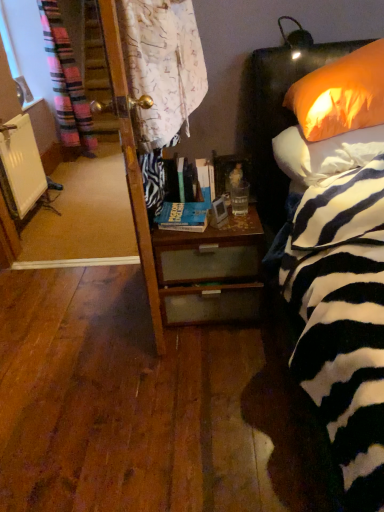
Question: Does hardcover book at center, the 1th book from the front, appear on the right side of orange fabric pillow at upper right, arranged as the 2th pillow when ordered from the bottom?

Choices:
 (A) no
 (B) yes

Answer: (A)

Question: Is orange fabric pillow at upper right, which is the 1th pillow from top to bottom, located within hardcover book at center, the 1th book from the front?

Choices:
 (A) no
 (B) yes

Answer: (A)

Question: Is hardcover book at center, which is counted as the 2th book, starting from the top, touching orange fabric pillow at upper right, arranged as the 2th pillow when ordered from the bottom?

Choices:
 (A) no
 (B) yes

Answer: (A)

Question: Is hardcover book at center, the second book positioned from the back, not within orange fabric pillow at upper right, arranged as the 2th pillow when ordered from the bottom?

Choices:
 (A) no
 (B) yes

Answer: (B)

Question: Considering the relative sizes of hardcover book at center, which is counted as the 2th book, starting from the top, and orange fabric pillow at upper right, which is the 1th pillow from top to bottom, in the image provided, is hardcover book at center, which is counted as the 2th book, starting from the top, wider than orange fabric pillow at upper right, which is the 1th pillow from top to bottom,?

Choices:
 (A) no
 (B) yes

Answer: (A)

Question: From a real-world perspective, is hardcover book at center, the 1th book from the front, positioned over orange fabric pillow at upper right, which is the 1th pillow from top to bottom, based on gravity?

Choices:
 (A) yes
 (B) no

Answer: (B)

Question: Can you confirm if white matte radiator at left is shorter than translucent glass at bedside?

Choices:
 (A) yes
 (B) no

Answer: (B)

Question: From the image's perspective, is white matte radiator at left above translucent glass at bedside?

Choices:
 (A) yes
 (B) no

Answer: (A)

Question: From a real-world perspective, is white matte radiator at left positioned under translucent glass at bedside based on gravity?

Choices:
 (A) yes
 (B) no

Answer: (A)

Question: Is white matte radiator at left aimed at translucent glass at bedside?

Choices:
 (A) no
 (B) yes

Answer: (A)

Question: Does white matte radiator at left have a greater height compared to translucent glass at bedside?

Choices:
 (A) no
 (B) yes

Answer: (B)

Question: Is translucent glass at bedside a part of white matte radiator at left?

Choices:
 (A) no
 (B) yes

Answer: (A)

Question: Does woodendesk at center touch white matte radiator at left?

Choices:
 (A) no
 (B) yes

Answer: (A)